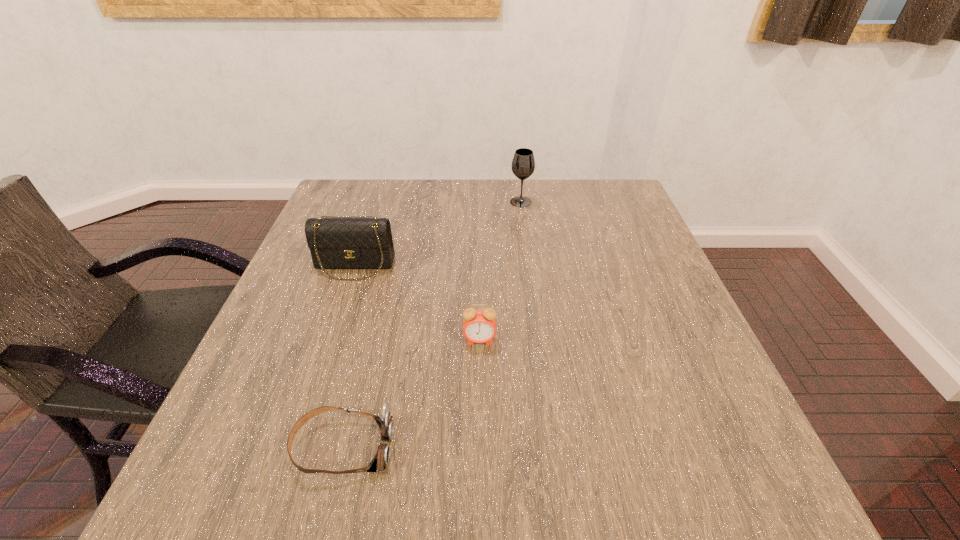
The width and height of the screenshot is (960, 540). I want to click on free spot at the far right corner of the desktop, so click(588, 183).

Identify the location of vacant space at the near right corner of the desktop. Image resolution: width=960 pixels, height=540 pixels. (745, 483).

Locate an element on the screen. The image size is (960, 540). vacant region between the wineglass and the alarm clock is located at coordinates (500, 271).

This screenshot has height=540, width=960. What are the coordinates of `free space between the nearest object and the farthest object` in the screenshot? It's located at (432, 325).

Locate an element on the screen. This screenshot has width=960, height=540. vacant region between the rightmost object and the clutch bag is located at coordinates (438, 234).

Image resolution: width=960 pixels, height=540 pixels. I want to click on free space between the clutch bag and the farthest object, so click(438, 234).

At what (x,y) coordinates should I click in order to perform the action: click on empty location between the nearest object and the rightmost object. Please return your answer as a coordinate pair (x, y). The height and width of the screenshot is (540, 960). Looking at the image, I should click on (432, 325).

Identify the location of vacant point located between the goggles and the tallest object. (432, 325).

Locate an element on the screen. This screenshot has width=960, height=540. blank region between the clutch bag and the goggles is located at coordinates (348, 356).

Identify the location of vacant space in between the second object from right to left and the nearest object. The width and height of the screenshot is (960, 540). (412, 394).